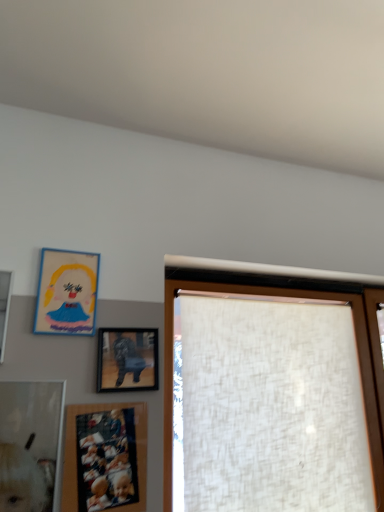
Question: Visually, is matte wooden picture frame at upper left, arranged as the fourth picture frame when viewed from the right, positioned to the left or to the right of matte wooden picture frame at lower left, placed as the 2th picture frame when sorted from right to left?

Choices:
 (A) left
 (B) right

Answer: (A)

Question: Which is correct: matte wooden picture frame at upper left, arranged as the 1th picture frame when viewed from the left, is inside matte wooden picture frame at lower left, the 3th picture frame positioned from the left, or outside of it?

Choices:
 (A) outside
 (B) inside

Answer: (A)

Question: Considering the real-world distances, which object is farthest from the matte cardboard picture frame at upper left, which appears as the third picture frame when viewed from the right?

Choices:
 (A) matte black picture frame at center, which ranks as the 4th picture frame in left-to-right order
 (B) matte wooden picture frame at upper left, arranged as the fourth picture frame when viewed from the right
 (C) matte wooden picture frame at lower left, the 3th picture frame positioned from the left
 (D) white textured curtain at right

Answer: (D)

Question: Which is farther from the matte wooden picture frame at upper left, arranged as the fourth picture frame when viewed from the right?

Choices:
 (A) matte black picture frame at center, which ranks as the 4th picture frame in left-to-right order
 (B) white textured curtain at right
 (C) matte wooden picture frame at lower left, the 3th picture frame positioned from the left
 (D) matte cardboard picture frame at upper left, the second picture frame viewed from the left

Answer: (B)